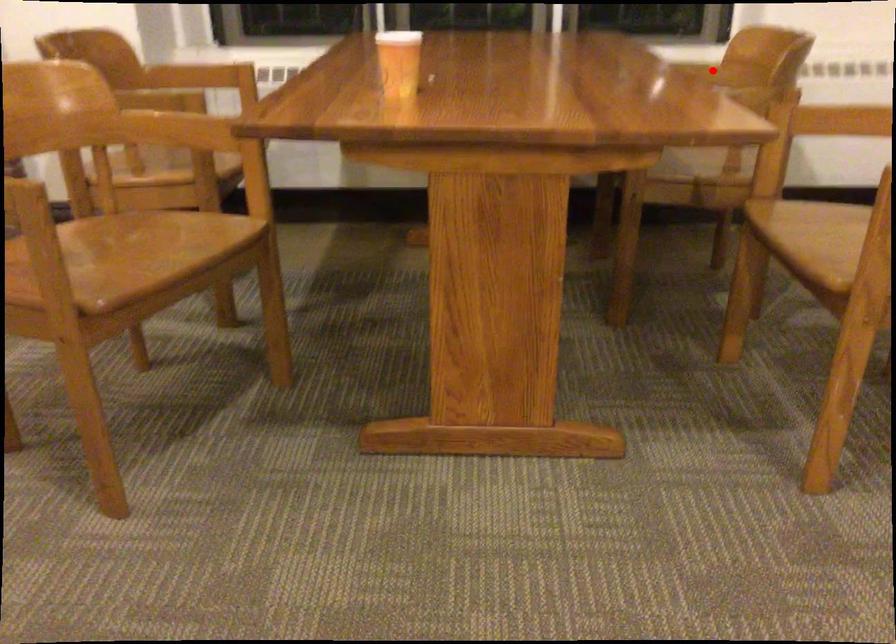
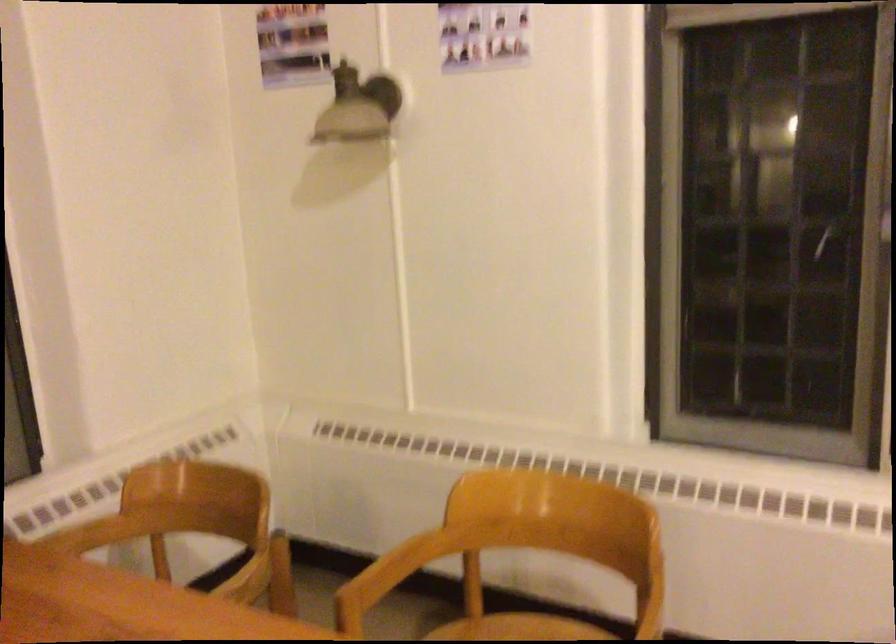
Where in the second image is the point corresponding to the highlighted location from the first image?

(92, 534)